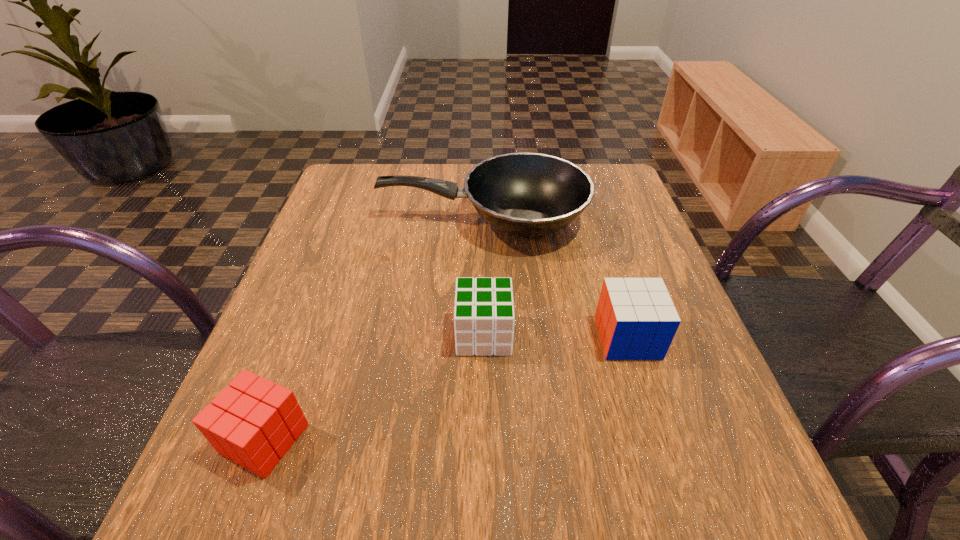
The width and height of the screenshot is (960, 540). I want to click on empty space between the rightmost cube and the farthest object, so click(555, 279).

This screenshot has height=540, width=960. Find the location of `free spot between the frying pan and the rightmost cube`. free spot between the frying pan and the rightmost cube is located at coordinates 555,279.

Locate an element on the screen. free point between the rightmost cube and the second cube from right to left is located at coordinates (556, 336).

The image size is (960, 540). I want to click on empty space that is in between the leftmost cube and the second cube from right to left, so click(374, 387).

Where is `object that is the third closest to the rightmost cube`? object that is the third closest to the rightmost cube is located at coordinates (254, 422).

The width and height of the screenshot is (960, 540). Find the location of `object that is the nearest to the rightmost cube`. object that is the nearest to the rightmost cube is located at coordinates (484, 317).

Point out which cube is positioned as the nearest to the leftmost cube. Please provide its 2D coordinates. Your answer should be formatted as a tuple, i.e. [(x, y)], where the tuple contains the x and y coordinates of a point satisfying the conditions above.

[(484, 317)]

Select which cube is the closest to the nearest cube. Please provide its 2D coordinates. Your answer should be formatted as a tuple, i.e. [(x, y)], where the tuple contains the x and y coordinates of a point satisfying the conditions above.

[(484, 317)]

Locate an element on the screen. The width and height of the screenshot is (960, 540). free spot that satisfies the following two spatial constraints: 1. on the front side of the rightmost cube; 2. on the right side of the frying pan is located at coordinates (484, 338).

Identify the location of vacant position in the image that satisfies the following two spatial constraints: 1. on the back side of the nearest cube; 2. on the left side of the rightmost cube. (302, 338).